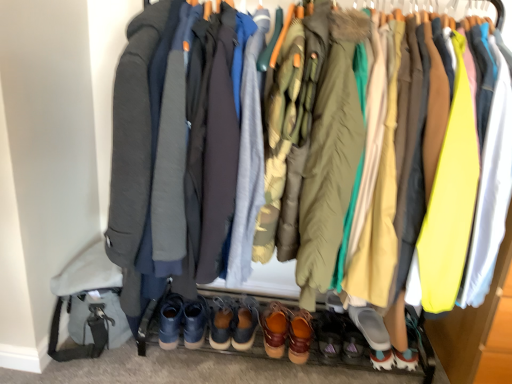
Question: From the image's perspective, is brown leather shoe at center, the 3th footwear in the right-to-left sequence, located above or below matte gray jacket at center, arranged as the second jacket when viewed from the right?

Choices:
 (A) above
 (B) below

Answer: (B)

Question: From their relative heights in the image, would you say brown leather shoe at center, the 3th footwear in the right-to-left sequence, is taller or shorter than matte gray jacket at center, arranged as the second jacket when viewed from the right?

Choices:
 (A) tall
 (B) short

Answer: (B)

Question: Estimate the real-world distances between objects in this image. Which object is closer to the brown leather shoes at center, which appears as the fifth footwear when viewed from the right?

Choices:
 (A) gray rubber slipper at lower center, the seventh footwear from the left
 (B) matte gray shoe at lower center, placed as the 6th footwear when sorted from left to right
 (C) matte gray jacket at center, which ranks as the first jacket in left-to-right order
 (D) dark gray wool coat at center, which appears as the third robe when viewed from the right
 (E) olive green puffer jacket at center, which is counted as the 2th jacket, starting from the left

Answer: (B)

Question: Which is farther from the dark gray wool coat at center, which appears as the third robe when viewed from the right?

Choices:
 (A) brown suede shoes at center, the 1th footwear viewed from the left
 (B) matte yellow fabric at right, arranged as the 1th robe when viewed from the right
 (C) camouflage fabric jacket at center, marked as the 2th robe in a right-to-left arrangement
 (D) matte gray shoe at lower center, which is the 2th footwear from right to left
 (E) matte gray jacket at center, arranged as the second jacket when viewed from the right

Answer: (D)